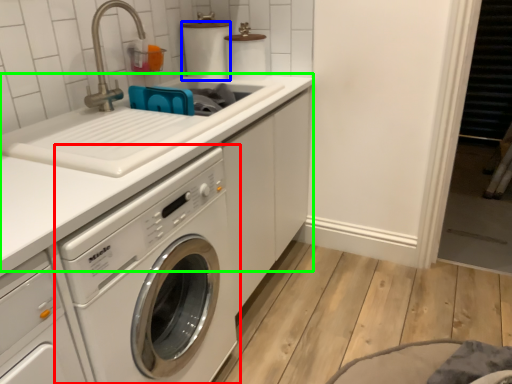
Question: Which is farther away from washing machine (highlighted by a red box)? toilet paper (highlighted by a blue box) or counter top (highlighted by a green box)?

Choices:
 (A) toilet paper
 (B) counter top

Answer: (A)